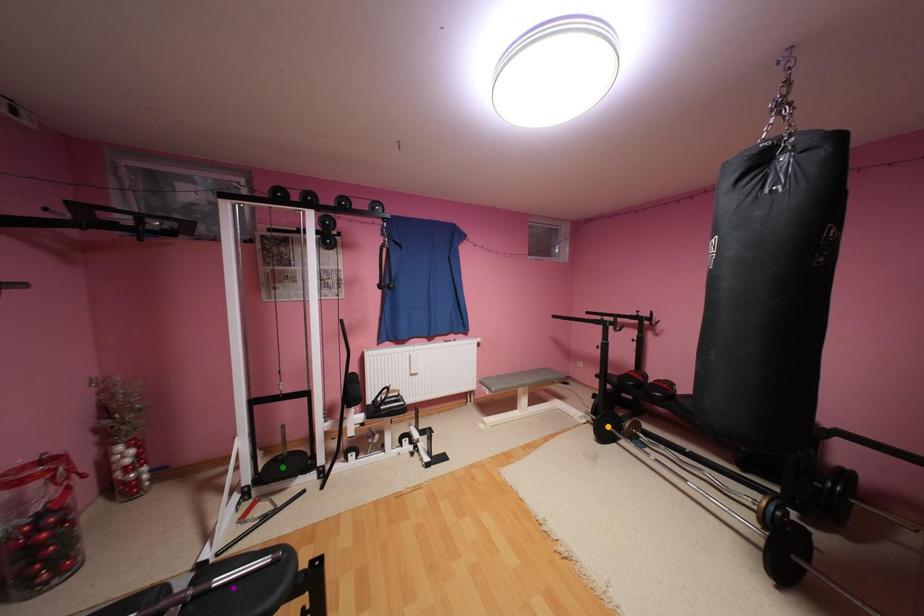
Order these from nearest to farthest:
1. purple point
2. green point
3. orange point

1. purple point
2. green point
3. orange point